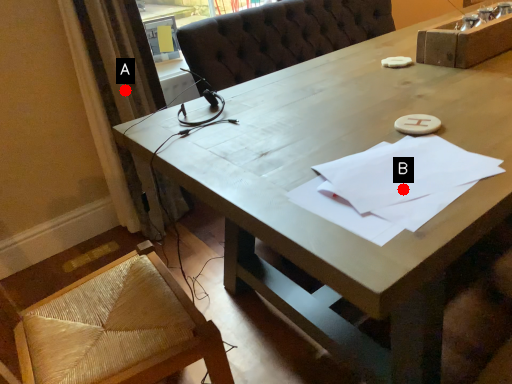
Question: Two points are circled on the image, labeled by A and B beside each circle. Among these points, which one is nearest to the camera?

Choices:
 (A) A is closer
 (B) B is closer

Answer: (B)